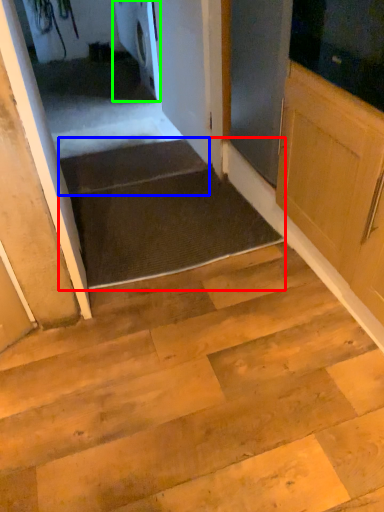
Question: Which object is the closest to the stairwell (highlighted by a red box)? Choose among these: stairs (highlighted by a blue box) or appliance (highlighted by a green box).

Choices:
 (A) stairs
 (B) appliance

Answer: (A)